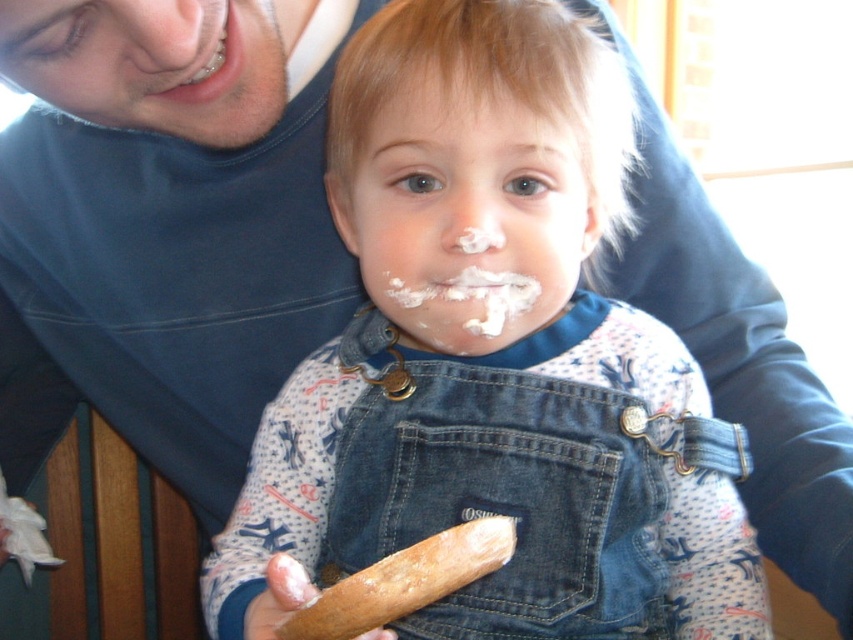
Question: Is white matte face at center thinner than white creamy icing at center?

Choices:
 (A) no
 (B) yes

Answer: (A)

Question: Which object is positioned farthest from the white matte face at center?

Choices:
 (A) matte blue shirt at upper left
 (B) white creamy icing at center
 (C) denim overalls at center

Answer: (A)

Question: Which is farther from the denim overalls at center?

Choices:
 (A) white matte face at center
 (B) white creamy icing at center

Answer: (B)

Question: Is denim overalls at center to the right of white creamy icing at center from the viewer's perspective?

Choices:
 (A) yes
 (B) no

Answer: (A)

Question: Is denim overalls at center above white creamy icing at center?

Choices:
 (A) yes
 (B) no

Answer: (B)

Question: Which object appears farthest from the camera in this image?

Choices:
 (A) matte blue shirt at upper left
 (B) white matte face at center
 (C) white creamy icing at center
 (D) denim overalls at center

Answer: (C)